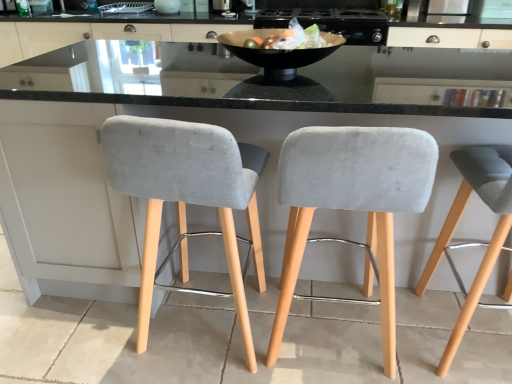
Question: Can you confirm if black glossy bowl at center is positioned to the left of matte white cabinet at upper center?

Choices:
 (A) no
 (B) yes

Answer: (A)

Question: Does black glossy bowl at center have a larger size compared to matte white cabinet at upper center?

Choices:
 (A) no
 (B) yes

Answer: (A)

Question: From a real-world perspective, is black glossy bowl at center on matte white cabinet at upper center?

Choices:
 (A) yes
 (B) no

Answer: (A)

Question: Is the depth of black glossy bowl at center greater than that of matte white cabinet at upper center?

Choices:
 (A) yes
 (B) no

Answer: (B)

Question: Is black glossy bowl at center thinner than matte white cabinet at upper center?

Choices:
 (A) no
 (B) yes

Answer: (B)

Question: From a real-world perspective, is black glossy bowl at center beneath matte white cabinet at upper center?

Choices:
 (A) no
 (B) yes

Answer: (A)

Question: Does metallic black pan at upper center, which is counted as the 2th appliance, starting from the left, have a greater width compared to velvet grey bar stool at right, which is the 1th chair in right-to-left order?

Choices:
 (A) yes
 (B) no

Answer: (A)

Question: Is metallic black pan at upper center, which is counted as the 2th appliance, starting from the left, bigger than velvet grey bar stool at right, which is the 1th chair in right-to-left order?

Choices:
 (A) no
 (B) yes

Answer: (B)

Question: Considering the relative positions of metallic black pan at upper center, placed as the first appliance when sorted from right to left, and velvet grey bar stool at right, the 3th chair in the left-to-right sequence, in the image provided, is metallic black pan at upper center, placed as the first appliance when sorted from right to left, behind velvet grey bar stool at right, the 3th chair in the left-to-right sequence,?

Choices:
 (A) yes
 (B) no

Answer: (A)

Question: From the image's perspective, is metallic black pan at upper center, placed as the first appliance when sorted from right to left, under velvet grey bar stool at right, the 3th chair in the left-to-right sequence?

Choices:
 (A) yes
 (B) no

Answer: (B)

Question: Is metallic black pan at upper center, placed as the first appliance when sorted from right to left, positioned far away from velvet grey bar stool at right, the 3th chair in the left-to-right sequence?

Choices:
 (A) no
 (B) yes

Answer: (B)

Question: From a real-world perspective, is metallic black pan at upper center, placed as the first appliance when sorted from right to left, on top of velvet grey bar stool at right, which is the 1th chair in right-to-left order?

Choices:
 (A) no
 (B) yes

Answer: (B)

Question: Does velvet grey bar stool at left, which appears as the 1th chair when viewed from the left, have a greater height compared to matte white cabinet at upper center?

Choices:
 (A) yes
 (B) no

Answer: (A)